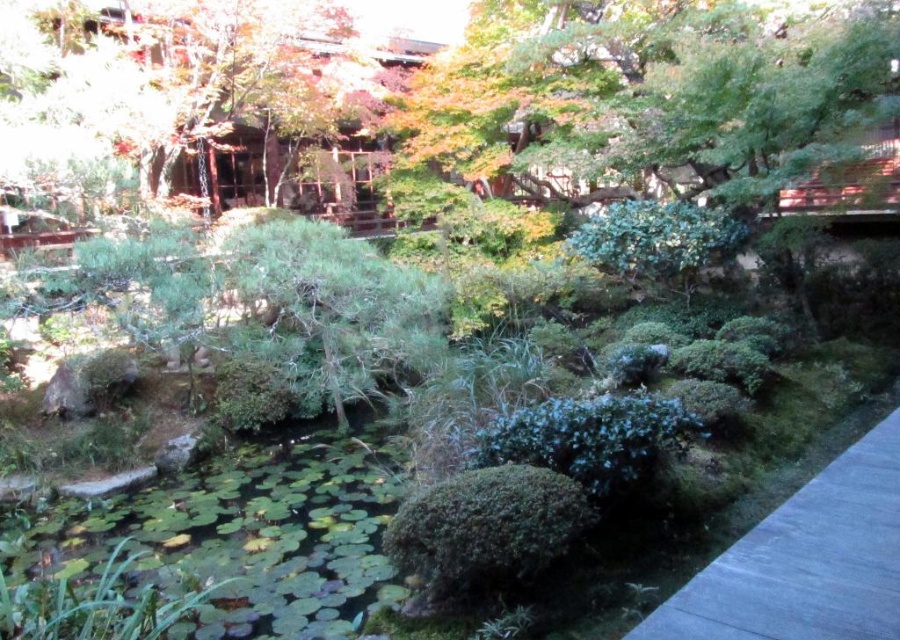
Which is below, green leafy pond at lower left or green leafy bush at center?

green leafy pond at lower left is below.

Does green leafy pond at lower left have a greater width compared to green leafy bush at center?

Correct, the width of green leafy pond at lower left exceeds that of green leafy bush at center.

Which is in front, point (93, 509) or point (632, 230)?

Point (93, 509)

Find the location of `green leafy pond at lower left`. green leafy pond at lower left is located at coordinates (249, 534).

Between green mossy bush at center and green matte bush at center, which one appears on the left side from the viewer's perspective?

green mossy bush at center is more to the left.

The image size is (900, 640). What do you see at coordinates (486, 531) in the screenshot?
I see `green mossy bush at center` at bounding box center [486, 531].

Find the location of a particular element. Image resolution: width=900 pixels, height=640 pixels. green mossy bush at center is located at coordinates (486, 531).

Does green leafy pond at lower left appear under green matte bush at center?

Correct, green leafy pond at lower left is located below green matte bush at center.

Measure the distance between green leafy pond at lower left and camera.

A distance of 6.20 feet exists between green leafy pond at lower left and camera.

Locate an element on the screen. green leafy pond at lower left is located at coordinates (249, 534).